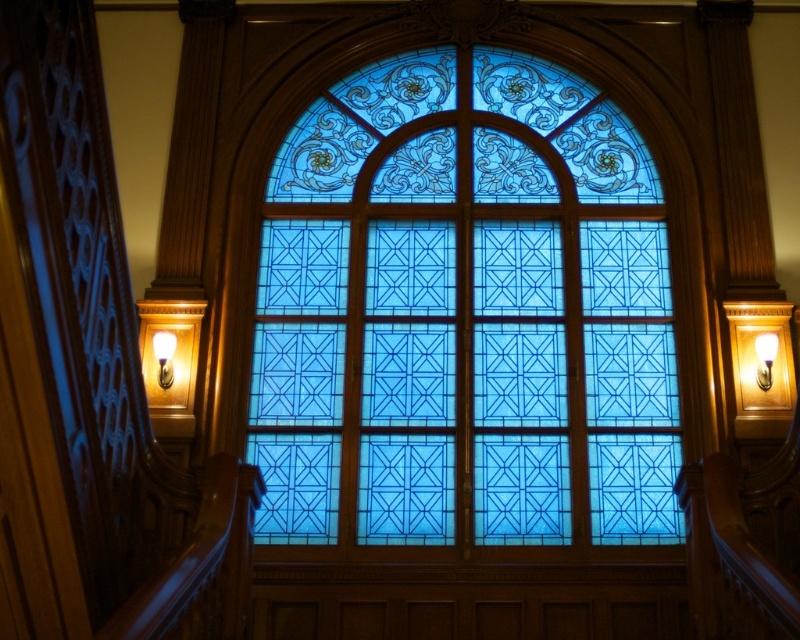
Between blue stained glass at center and white glossy wall sconce at upper center, which one appears on the left side from the viewer's perspective?

blue stained glass at center is more to the left.

Is point (264, 326) less distant than point (758, 340)?

No, (264, 326) is behind (758, 340).

Who is more distant from viewer, (x=552, y=401) or (x=764, y=362)?

Positioned behind is point (x=552, y=401).

Find the location of a particular element. The height and width of the screenshot is (640, 800). blue stained glass at center is located at coordinates (464, 316).

Is blue stained glass at center bigger than matte white lamp at upper center?

Correct, blue stained glass at center is larger in size than matte white lamp at upper center.

Is blue stained glass at center taller than matte white lamp at upper center?

Indeed, blue stained glass at center has a greater height compared to matte white lamp at upper center.

The width and height of the screenshot is (800, 640). What do you see at coordinates (464, 316) in the screenshot?
I see `blue stained glass at center` at bounding box center [464, 316].

The image size is (800, 640). Find the location of `blue stained glass at center`. blue stained glass at center is located at coordinates (464, 316).

Is blue stained glass at center wider than wooden handrail at left?

Indeed, blue stained glass at center has a greater width compared to wooden handrail at left.

Is blue stained glass at center taller than wooden handrail at left?

Yes, blue stained glass at center is taller than wooden handrail at left.

Which is in front, point (524, 348) or point (57, 234)?

Point (57, 234) is more forward.

The image size is (800, 640). What are the coordinates of `blue stained glass at center` in the screenshot? It's located at (464, 316).